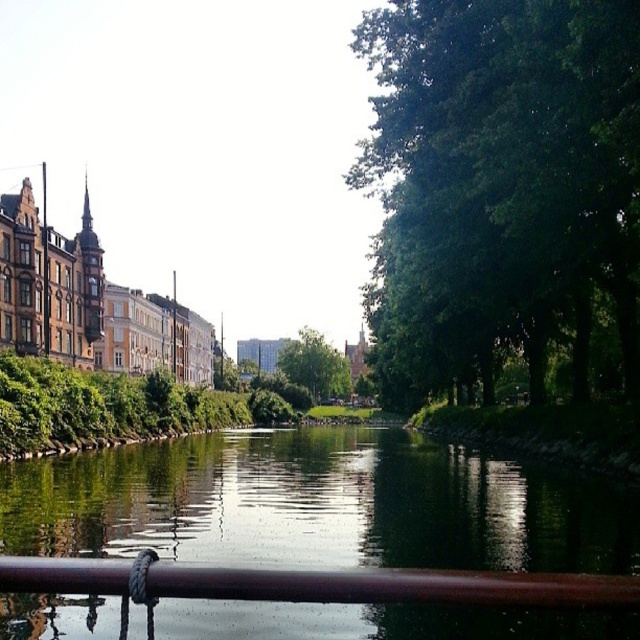
Which of these two, green leafy trees at right or brown polished metal rail at lower center, stands shorter?

brown polished metal rail at lower center is shorter.

Does point (550, 236) lie in front of point (502, 602)?

That is False.

Does point (413, 108) come behind point (170, 586)?

Yes, it is.

Locate an element on the screen. green leafy trees at right is located at coordinates (502, 189).

Based on the photo, is green reflective water at center closer to the viewer compared to brown polished metal rail at lower center?

No, green reflective water at center is behind brown polished metal rail at lower center.

Is green reflective water at center taller than brown polished metal rail at lower center?

Yes.

Who is more forward, (x=301, y=620) or (x=305, y=589)?

Positioned in front is point (x=305, y=589).

You are a GUI agent. You are given a task and a screenshot of the screen. Output one action in this format:
    pyautogui.click(x=<x>, y=<y>)
    Task: Click on the green reflective water at center
    Image resolution: width=640 pixels, height=640 pixels.
    Given the screenshot: What is the action you would take?
    317,504

Who is lower down, green leafy trees at right or green leafy tree at center?

Positioned lower is green leafy tree at center.

What do you see at coordinates (502, 189) in the screenshot?
I see `green leafy trees at right` at bounding box center [502, 189].

Does point (616, 307) come in front of point (340, 394)?

Yes, point (616, 307) is closer to viewer.

You are a GUI agent. You are given a task and a screenshot of the screen. Output one action in this format:
    pyautogui.click(x=<x>, y=<y>)
    Task: Click on the green leafy trees at right
    
    Given the screenshot: What is the action you would take?
    pyautogui.click(x=502, y=189)